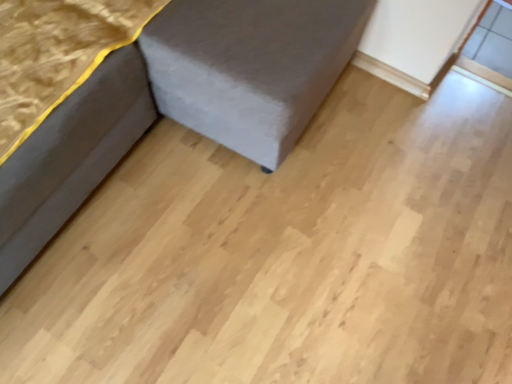
Question: Considering the relative sizes of velvet grey sofa at lower left, the 2th furniture viewed from the left, and dark gray fabric at lower left, which ranks as the second furniture in right-to-left order, in the image provided, is velvet grey sofa at lower left, the 2th furniture viewed from the left, thinner than dark gray fabric at lower left, which ranks as the second furniture in right-to-left order,?

Choices:
 (A) no
 (B) yes

Answer: (A)

Question: Is velvet grey sofa at lower left, the 2th furniture viewed from the left, closer to the viewer compared to dark gray fabric at lower left, which appears as the 1th furniture when viewed from the left?

Choices:
 (A) no
 (B) yes

Answer: (B)

Question: Is velvet grey sofa at lower left, placed as the first furniture when sorted from right to left, far from dark gray fabric at lower left, which ranks as the second furniture in right-to-left order?

Choices:
 (A) yes
 (B) no

Answer: (B)

Question: Is dark gray fabric at lower left, which ranks as the second furniture in right-to-left order, located within velvet grey sofa at lower left, placed as the first furniture when sorted from right to left?

Choices:
 (A) yes
 (B) no

Answer: (A)

Question: Is velvet grey sofa at lower left, the 2th furniture viewed from the left, next to dark gray fabric at lower left, which appears as the 1th furniture when viewed from the left, and touching it?

Choices:
 (A) no
 (B) yes

Answer: (B)

Question: From a real-world perspective, is velvet grey sofa at lower left, placed as the first furniture when sorted from right to left, positioned over dark gray fabric at lower left, which appears as the 1th furniture when viewed from the left, based on gravity?

Choices:
 (A) yes
 (B) no

Answer: (A)

Question: Is dark gray fabric at lower left, which ranks as the second furniture in right-to-left order, smaller than velvet grey sofa at lower left, the 2th furniture viewed from the left?

Choices:
 (A) no
 (B) yes

Answer: (B)

Question: From the image's perspective, is dark gray fabric at lower left, which ranks as the second furniture in right-to-left order, on top of velvet grey sofa at lower left, placed as the first furniture when sorted from right to left?

Choices:
 (A) yes
 (B) no

Answer: (B)

Question: Is dark gray fabric at lower left, which ranks as the second furniture in right-to-left order, shorter than velvet grey sofa at lower left, placed as the first furniture when sorted from right to left?

Choices:
 (A) yes
 (B) no

Answer: (A)

Question: Is velvet grey sofa at lower left, the 2th furniture viewed from the left, surrounded by dark gray fabric at lower left, which appears as the 1th furniture when viewed from the left?

Choices:
 (A) yes
 (B) no

Answer: (B)

Question: Is dark gray fabric at lower left, which appears as the 1th furniture when viewed from the left, positioned behind velvet grey sofa at lower left, the 2th furniture viewed from the left?

Choices:
 (A) no
 (B) yes

Answer: (B)

Question: Does dark gray fabric at lower left, which ranks as the second furniture in right-to-left order, have a lesser width compared to velvet grey sofa at lower left, placed as the first furniture when sorted from right to left?

Choices:
 (A) yes
 (B) no

Answer: (A)

Question: From the image's perspective, is velvet grey sofa at lower left, placed as the first furniture when sorted from right to left, located above or below dark gray fabric at lower left, which ranks as the second furniture in right-to-left order?

Choices:
 (A) below
 (B) above

Answer: (B)